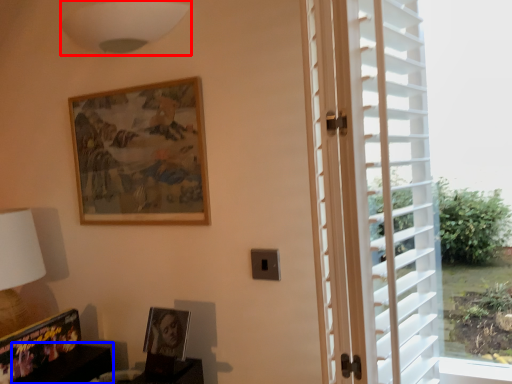
Question: Which of the following is the farthest to the observer, lamp (highlighted by a red box) or furniture (highlighted by a blue box)?

Choices:
 (A) lamp
 (B) furniture

Answer: (B)